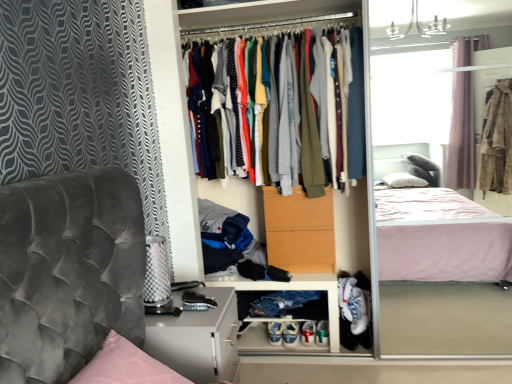
Question: Relative to matte white dresser at center, is multicolored fabric shirts at center in front or behind?

Choices:
 (A) front
 (B) behind

Answer: (B)

Question: Looking at the image, does multicolored fabric shirts at center seem bigger or smaller compared to matte white dresser at center?

Choices:
 (A) big
 (B) small

Answer: (B)

Question: Estimate the real-world distances between objects in this image. Which object is closer to the white leather sneakers at lower center, the second footwear in the right-to-left sequence?

Choices:
 (A) matte white dresser at center
 (B) multicolored fabric shirts at center
 (C) white plastic cabinet at lower center
 (D) white leather sneakers at lower center, the second footwear when ordered from left to right
 (E) matte orange drawer at center

Answer: (D)

Question: Which is nearer to the white plastic cabinet at lower center?

Choices:
 (A) white leather sneakers at lower center, the 1th footwear from the left
 (B) multicolored fabric shirts at center
 (C) matte white dresser at center
 (D) matte gray cabinet at lower left
 (E) white leather sneakers at lower center, the second footwear when ordered from left to right

Answer: (E)